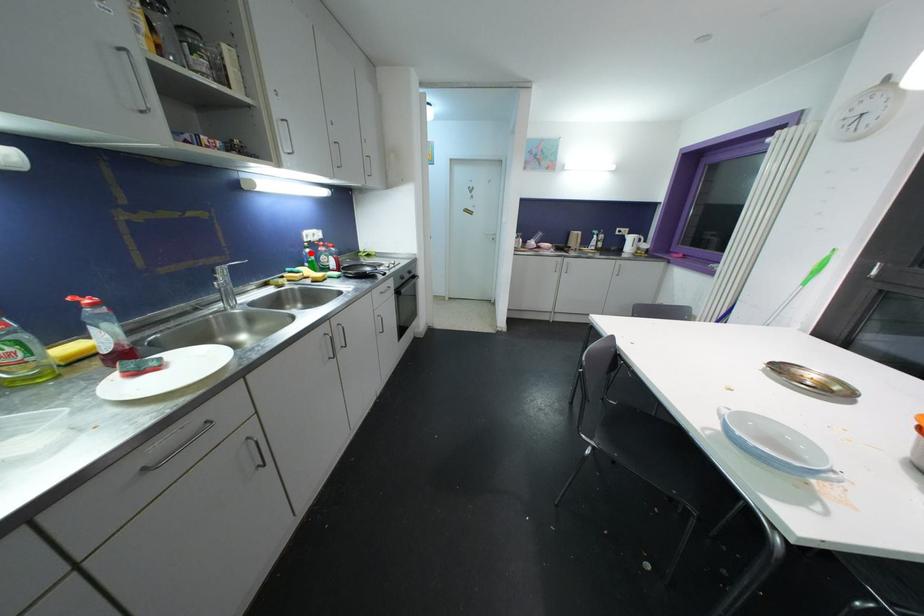
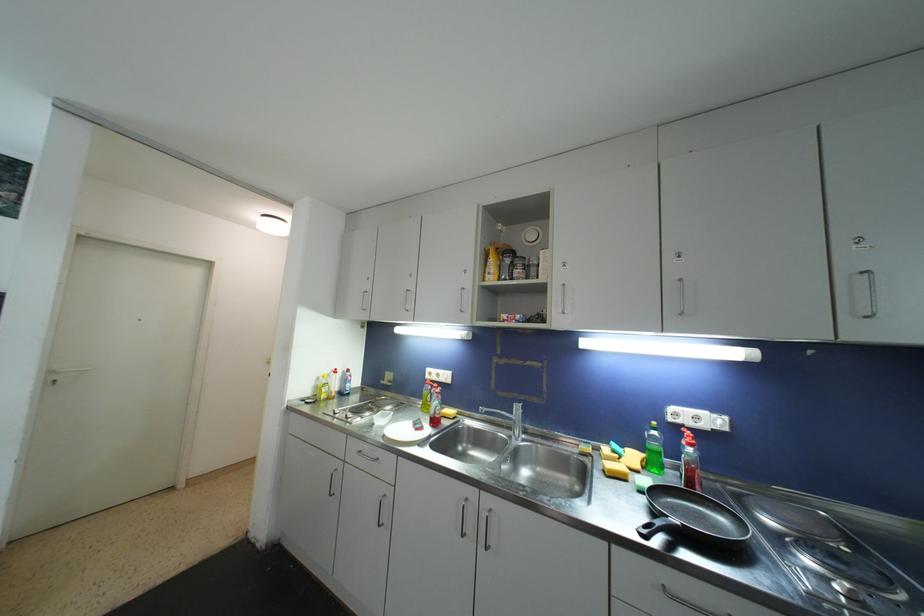
Question: I am providing you with two images of the same scene from different viewpoints. Given a red point in image1, look at the same physical point in image2. Is it:

Choices:
 (A) Closer to the viewpoint
 (B) Farther from the viewpoint

Answer: (B)